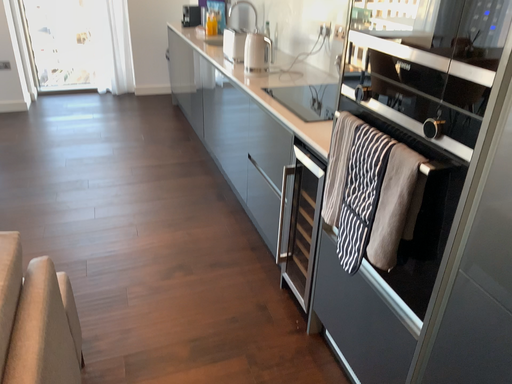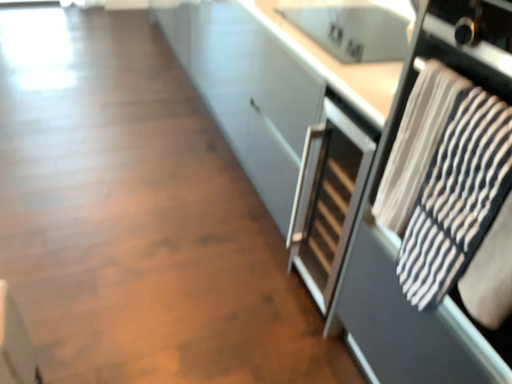
Question: How did the camera likely rotate when shooting the video?

Choices:
 (A) rotated downward
 (B) rotated upward

Answer: (A)